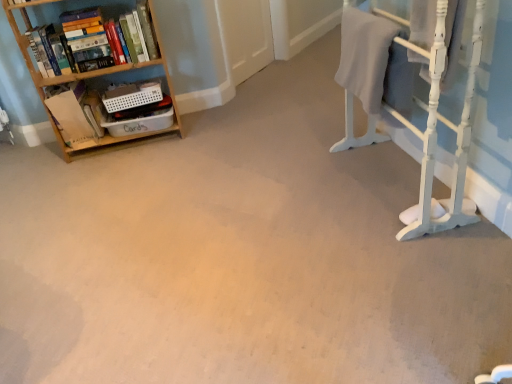
The height and width of the screenshot is (384, 512). What do you see at coordinates (436, 133) in the screenshot? I see `white painted wood bunk bed at right` at bounding box center [436, 133].

Image resolution: width=512 pixels, height=384 pixels. What do you see at coordinates (86, 74) in the screenshot? I see `wooden bookshelf at left` at bounding box center [86, 74].

The height and width of the screenshot is (384, 512). I want to click on hardcover books at left, so click(x=102, y=44).

Identify the location of shelf that is behind the white painted wood bunk bed at right. (86, 74).

Is wooden bookshelf at left directly adjacent to white painted wood bunk bed at right?

There is a gap between wooden bookshelf at left and white painted wood bunk bed at right.

Is white painted wood bunk bed at right at the back of wooden bookshelf at left?

No, wooden bookshelf at left is not facing away from white painted wood bunk bed at right.

Can you confirm if hardcover books at left is wider than gray cotton bath towel at upper right?

Indeed, hardcover books at left has a greater width compared to gray cotton bath towel at upper right.

Considering the positions of objects hardcover books at left and gray cotton bath towel at upper right in the image provided, who is more to the right, hardcover books at left or gray cotton bath towel at upper right?

From the viewer's perspective, gray cotton bath towel at upper right appears more on the right side.

Does point (24, 56) appear closer or farther from the camera than point (355, 31)?

Point (24, 56) is farther from the camera than point (355, 31).

Is hardcover books at left looking in the opposite direction of gray cotton bath towel at upper right?

No, hardcover books at left is not facing away from gray cotton bath towel at upper right.

Can you confirm if white painted wood bunk bed at right is taller than gray cotton bath towel at upper right?

Yes.

Is point (380, 135) farther from viewer compared to point (371, 104)?

That is True.

Would you say white painted wood bunk bed at right is outside gray cotton bath towel at upper right?

Absolutely, white painted wood bunk bed at right is external to gray cotton bath towel at upper right.

Who is smaller, white painted wood bunk bed at right or gray cotton bath towel at upper right?

gray cotton bath towel at upper right.

Could you tell me if white painted wood bunk bed at right is turned towards hardcover books at left?

No, white painted wood bunk bed at right does not turn towards hardcover books at left.

Is the depth of white painted wood bunk bed at right greater than that of hardcover books at left?

No, white painted wood bunk bed at right is closer to the camera.

Is point (460, 187) positioned after point (92, 40)?

No, (460, 187) is closer to viewer.

Does white painted wood bunk bed at right have a larger size compared to hardcover books at left?

Yes, white painted wood bunk bed at right is bigger than hardcover books at left.

In the scene shown: From the image's perspective, relative to hardcover books at left, is wooden bookshelf at left above or below?

wooden bookshelf at left is situated lower than hardcover books at left in the image.

Identify the location of shelf below the hardcover books at left (from the image's perspective). The image size is (512, 384). (86, 74).

Can you see wooden bookshelf at left touching hardcover books at left?

Indeed, wooden bookshelf at left and hardcover books at left are beside each other and touching.

Is point (153, 66) less distant than point (68, 1)?

Yes, it is.

Considering the sizes of hardcover books at left and white painted wood bunk bed at right in the image, is hardcover books at left bigger or smaller than white painted wood bunk bed at right?

hardcover books at left is smaller than white painted wood bunk bed at right.

Is hardcover books at left facing away from white painted wood bunk bed at right?

That's not correct — hardcover books at left is not looking away from white painted wood bunk bed at right.

Is point (122, 70) farther from camera compared to point (433, 61)?

Yes, point (122, 70) is farther from viewer.

Which is correct: hardcover books at left is inside white painted wood bunk bed at right, or outside of it?

hardcover books at left is located beyond the bounds of white painted wood bunk bed at right.

From the picture: Is gray cotton bath towel at upper right aimed at hardcover books at left?

No.

From a real-world perspective, between gray cotton bath towel at upper right and hardcover books at left, who is vertically lower?

gray cotton bath towel at upper right is physically lower.

From the image's perspective, is gray cotton bath towel at upper right on hardcover books at left?

No.

Considering the relative sizes of gray cotton bath towel at upper right and hardcover books at left in the image provided, is gray cotton bath towel at upper right wider than hardcover books at left?

Incorrect, the width of gray cotton bath towel at upper right does not surpass that of hardcover books at left.

Where is `shelf located on the left of white painted wood bunk bed at right`? The height and width of the screenshot is (384, 512). shelf located on the left of white painted wood bunk bed at right is located at coordinates (86, 74).

Image resolution: width=512 pixels, height=384 pixels. Find the location of `bath towel on the right of hardcover books at left`. bath towel on the right of hardcover books at left is located at coordinates (365, 55).

From the image, which object appears to be nearer to gray cotton bath towel at upper right, hardcover books at left or white painted wood bunk bed at right?

white painted wood bunk bed at right is positioned closer to the anchor gray cotton bath towel at upper right.

Looking at the image, which one is located closer to gray cotton bath towel at upper right, wooden bookshelf at left or hardcover books at left?

hardcover books at left is positioned closer to the anchor gray cotton bath towel at upper right.

Looking at the image, which one is located closer to hardcover books at left, gray cotton bath towel at upper right or white painted wood bunk bed at right?

Among the two, gray cotton bath towel at upper right is located nearer to hardcover books at left.

In the scene shown: Based on their spatial positions, is white painted wood bunk bed at right or gray cotton bath towel at upper right further from hardcover books at left?

white painted wood bunk bed at right is positioned further to the anchor hardcover books at left.

Which object lies nearer to the anchor point wooden bookshelf at left, hardcover books at left or gray cotton bath towel at upper right?

hardcover books at left lies closer to wooden bookshelf at left than the other object.

Estimate the real-world distances between objects in this image. Which object is closer to gray cotton bath towel at upper right, hardcover books at left or wooden bookshelf at left?

Based on the image, hardcover books at left appears to be nearer to gray cotton bath towel at upper right.

From the image, which object appears to be farther from wooden bookshelf at left, gray cotton bath towel at upper right or white painted wood bunk bed at right?

white painted wood bunk bed at right lies further to wooden bookshelf at left than the other object.

When comparing their distances from wooden bookshelf at left, does white painted wood bunk bed at right or hardcover books at left seem further?

Among the two, white painted wood bunk bed at right is located further to wooden bookshelf at left.

I want to click on book between wooden bookshelf at left and white painted wood bunk bed at right in the horizontal direction, so click(x=102, y=44).

Find the location of a particular element. The image size is (512, 384). bath towel between wooden bookshelf at left and white painted wood bunk bed at right is located at coordinates (365, 55).

Find the location of a particular element. The height and width of the screenshot is (384, 512). book located between wooden bookshelf at left and gray cotton bath towel at upper right in the left-right direction is located at coordinates (102, 44).

At what (x,y) coordinates should I click in order to perform the action: click on bath towel located between hardcover books at left and white painted wood bunk bed at right in the left-right direction. Please return your answer as a coordinate pair (x, y). Looking at the image, I should click on (365, 55).